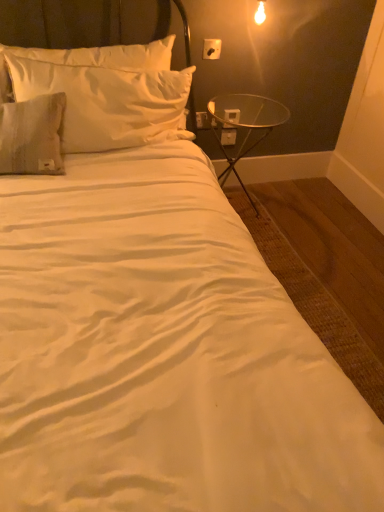
Question: Does point (226, 119) appear closer or farther from the camera than point (86, 86)?

Choices:
 (A) farther
 (B) closer

Answer: (A)

Question: Relative to satin white pillow at upper left, is white plastic electric outlet at upper right, the 2th electric outlet from the top, in front or behind?

Choices:
 (A) behind
 (B) front

Answer: (A)

Question: Which object is positioned closest to the white plastic electric outlet at upper right, the second electric outlet in the bottom-to-top sequence?

Choices:
 (A) white plastic electric outlet at upper right, the 3th electric outlet positioned from the front
 (B) white plastic electric outlet at upper right, which ranks as the 3th electric outlet in back-to-front order
 (C) satin white pillow at upper left
 (D) transparent glass table at right

Answer: (D)

Question: Estimate the real-world distances between objects in this image. Which object is farther from the satin white pillow at upper left?

Choices:
 (A) white plastic electric outlet at upper right, the third electric outlet positioned from the bottom
 (B) white plastic electric outlet at upper right, the second electric outlet from the back
 (C) transparent glass table at right
 (D) white plastic electric outlet at upper right, the 3th electric outlet positioned from the front

Answer: (D)